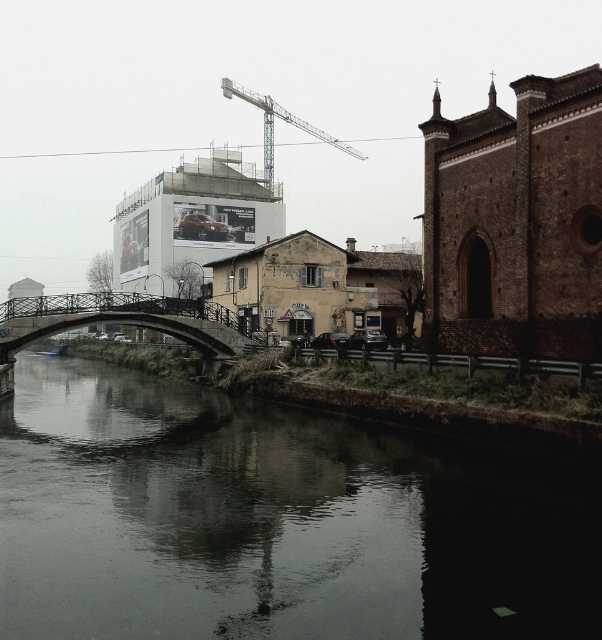
You are a tourist standing on the canal bank and want to take a photo of both the metallic bridge at center and the metallic gray crane at upper center. Which object should you focus on first if you want to capture both in the frame without moving your camera?

You should focus on the metallic bridge at center first because it is shorter than the metallic gray crane at upper center, allowing you to frame both by adjusting the camera angle to include the taller crane in the background.

You are a photographer standing on the arched bridge in the canal scene. You want to capture a photo that includes both the dark reflective water at center and the metallic gray crane at upper center. Which object will appear larger in your photo?

The dark reflective water at center will appear larger in the photo because it is closer to the viewer than the metallic gray crane at upper center.

You are a tourist standing at the edge of the canal and want to take a photo of the metallic bridge at center and the dark reflective water at center. If your camera can focus on objects up to 100 feet away, will both objects be in focus?

The dark reflective water at center is 84.03 feet from the metallic bridge at center. Since the camera can focus up to 100 feet, both objects are within the focus range and will be in focus.